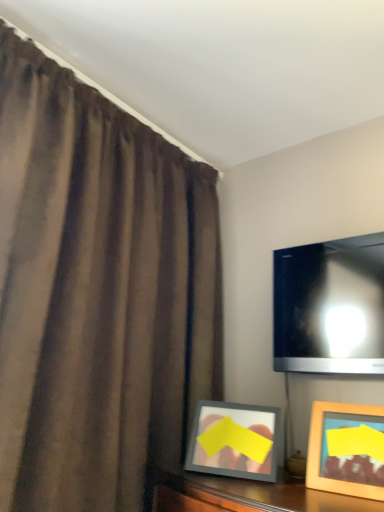
Question: Considering the relative sizes of brown matte curtain at left and matte black tv at upper right in the image provided, is brown matte curtain at left shorter than matte black tv at upper right?

Choices:
 (A) no
 (B) yes

Answer: (A)

Question: From the image's perspective, does brown matte curtain at left appear lower than matte black tv at upper right?

Choices:
 (A) yes
 (B) no

Answer: (B)

Question: Is brown matte curtain at left looking in the opposite direction of matte black tv at upper right?

Choices:
 (A) no
 (B) yes

Answer: (A)

Question: Does brown matte curtain at left appear on the right side of matte black tv at upper right?

Choices:
 (A) yes
 (B) no

Answer: (B)

Question: From a real-world perspective, is brown matte curtain at left on top of matte black tv at upper right?

Choices:
 (A) yes
 (B) no

Answer: (B)

Question: Is matte black tv at upper right taller or shorter than brown matte curtain at left?

Choices:
 (A) tall
 (B) short

Answer: (B)

Question: In the image, is matte black tv at upper right positioned in front of or behind brown matte curtain at left?

Choices:
 (A) behind
 (B) front

Answer: (A)

Question: In terms of size, does matte black tv at upper right appear bigger or smaller than brown matte curtain at left?

Choices:
 (A) small
 (B) big

Answer: (A)

Question: Is matte black tv at upper right spatially inside brown matte curtain at left, or outside of it?

Choices:
 (A) inside
 (B) outside

Answer: (B)

Question: Looking at the image, does wooden picture frame at lower right seem bigger or smaller compared to matte black tv at upper right?

Choices:
 (A) small
 (B) big

Answer: (A)

Question: In the image, is wooden picture frame at lower right positioned in front of or behind matte black tv at upper right?

Choices:
 (A) behind
 (B) front

Answer: (B)

Question: Is point (377, 435) closer or farther from the camera than point (357, 281)?

Choices:
 (A) farther
 (B) closer

Answer: (B)

Question: From the image's perspective, is wooden picture frame at lower right positioned above or below matte black tv at upper right?

Choices:
 (A) below
 (B) above

Answer: (A)

Question: Looking at their shapes, would you say brown matte curtain at left is wider or thinner than wooden picture frame at lower right?

Choices:
 (A) wide
 (B) thin

Answer: (A)

Question: Which is correct: brown matte curtain at left is inside wooden picture frame at lower right, or outside of it?

Choices:
 (A) inside
 (B) outside

Answer: (B)